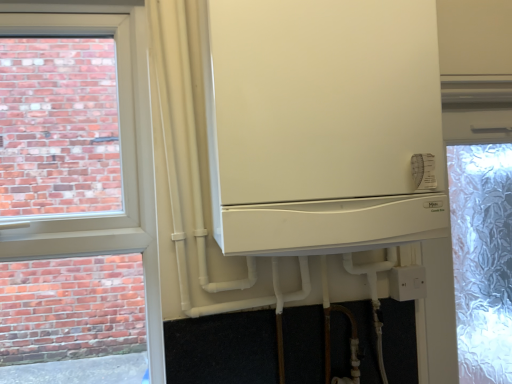
In order to face white plastic electric outlet at lower right, should I rotate leftwards or rightwards?

You should rotate right by 19.484 degrees.

Describe the element at coordinates (407, 282) in the screenshot. I see `white plastic electric outlet at lower right` at that location.

Where is `white plastic electric outlet at lower right`? This screenshot has height=384, width=512. white plastic electric outlet at lower right is located at coordinates (407, 282).

This screenshot has height=384, width=512. Describe the element at coordinates (322, 124) in the screenshot. I see `white matte refrigerator at center` at that location.

Based on the photo, measure the distance between white matte refrigerator at center and camera.

The depth of white matte refrigerator at center is 30.14 inches.

Locate an element on the screen. Image resolution: width=512 pixels, height=384 pixels. white matte refrigerator at center is located at coordinates (322, 124).

Where is `white plastic electric outlet at lower right`? The width and height of the screenshot is (512, 384). white plastic electric outlet at lower right is located at coordinates (407, 282).

Considering the relative positions of white matte refrigerator at center and white plastic electric outlet at lower right in the image provided, is white matte refrigerator at center to the right of white plastic electric outlet at lower right from the viewer's perspective?

In fact, white matte refrigerator at center is to the left of white plastic electric outlet at lower right.

Which object is more forward, white matte refrigerator at center or white plastic electric outlet at lower right?

white matte refrigerator at center is more forward.

Does point (287, 141) lie behind point (420, 265)?

No, it is not.

From the image's perspective, does white matte refrigerator at center appear lower than white plastic electric outlet at lower right?

Result: Incorrect, from the image's perspective, white matte refrigerator at center is higher than white plastic electric outlet at lower right.

From a real-world perspective, is white matte refrigerator at center positioned under white plastic electric outlet at lower right based on gravity?

Incorrect, from a real-world perspective, white matte refrigerator at center is higher than white plastic electric outlet at lower right.

Can you confirm if white matte refrigerator at center is wider than white plastic electric outlet at lower right?

Indeed, white matte refrigerator at center has a greater width compared to white plastic electric outlet at lower right.

Does white matte refrigerator at center have a greater height compared to white plastic electric outlet at lower right?

Yes.

In terms of size, does white matte refrigerator at center appear bigger or smaller than white plastic electric outlet at lower right?

Clearly, white matte refrigerator at center is larger in size than white plastic electric outlet at lower right.

Would you say white plastic electric outlet at lower right is part of white matte refrigerator at center's contents?

No, white plastic electric outlet at lower right is not inside white matte refrigerator at center.

Is white matte refrigerator at center next to white plastic electric outlet at lower right and touching it?

No, white matte refrigerator at center is not with white plastic electric outlet at lower right.

Looking at this image, is white matte refrigerator at center positioned with its back to white plastic electric outlet at lower right?

No, white matte refrigerator at center is not facing the opposite direction of white plastic electric outlet at lower right.

Can you tell me how much white matte refrigerator at center and white plastic electric outlet at lower right differ in facing direction?

The angular difference between white matte refrigerator at center and white plastic electric outlet at lower right is 0.364 degrees.

How much distance is there between white matte refrigerator at center and white plastic electric outlet at lower right?

white matte refrigerator at center is 54.03 centimeters from white plastic electric outlet at lower right.

This screenshot has width=512, height=384. Identify the location of electric outlet below the white matte refrigerator at center (from the image's perspective). (407, 282).

Is white plastic electric outlet at lower right to the right of white matte refrigerator at center from the viewer's perspective?

Yes, white plastic electric outlet at lower right is to the right of white matte refrigerator at center.

Which object is more forward, white plastic electric outlet at lower right or white matte refrigerator at center?

white matte refrigerator at center is closer to the camera.

Which is in front, point (424, 277) or point (385, 156)?

The point (385, 156) is closer to the camera.

From the image's perspective, which object appears higher, white plastic electric outlet at lower right or white matte refrigerator at center?

white matte refrigerator at center appears higher in the image.

From the picture: From a real-world perspective, which object stands above the other?

From a 3D spatial view, white matte refrigerator at center is above.

Which object is thinner, white plastic electric outlet at lower right or white matte refrigerator at center?

white plastic electric outlet at lower right.

Can you confirm if white plastic electric outlet at lower right is shorter than white matte refrigerator at center?

Correct, white plastic electric outlet at lower right is not as tall as white matte refrigerator at center.

Which of these two, white plastic electric outlet at lower right or white matte refrigerator at center, is smaller?

white plastic electric outlet at lower right.

Is white plastic electric outlet at lower right not inside white matte refrigerator at center?

Yes, white plastic electric outlet at lower right is not within white matte refrigerator at center.

Is white plastic electric outlet at lower right not close to white matte refrigerator at center?

Actually, white plastic electric outlet at lower right and white matte refrigerator at center are a little close together.

From the picture: Is white plastic electric outlet at lower right facing towards white matte refrigerator at center?

No, white plastic electric outlet at lower right does not turn towards white matte refrigerator at center.

How distant is white plastic electric outlet at lower right from white matte refrigerator at center?

white plastic electric outlet at lower right is 54.03 centimeters from white matte refrigerator at center.

The height and width of the screenshot is (384, 512). In the image, there is a white matte refrigerator at center. Find the location of `electric outlet below it (from a real-world perspective)`. electric outlet below it (from a real-world perspective) is located at coordinates (407, 282).

This screenshot has width=512, height=384. I want to click on electric outlet that appears below the white matte refrigerator at center (from the image's perspective), so click(x=407, y=282).

At what (x,y) coordinates should I click in order to perform the action: click on electric outlet behind the white matte refrigerator at center. Please return your answer as a coordinate pair (x, y). This screenshot has width=512, height=384. Looking at the image, I should click on (407, 282).